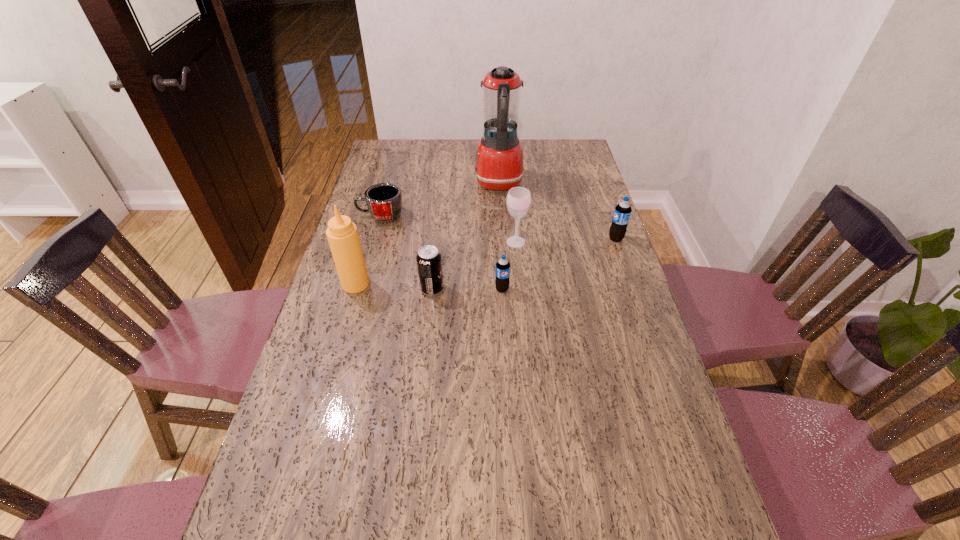
I want to click on vacant region that satisfies the following two spatial constraints: 1. on the back side of the rightmost object; 2. on the controls of the food processor, so click(x=596, y=184).

Where is `vacant space that satisfies the following two spatial constraints: 1. on the front side of the second tallest object; 2. on the right side of the second soda can from left to right`? vacant space that satisfies the following two spatial constraints: 1. on the front side of the second tallest object; 2. on the right side of the second soda can from left to right is located at coordinates (354, 289).

Where is `free space that satisfies the following two spatial constraints: 1. on the side of the fifth shortest object with the handle; 2. on the left side of the sixth nearest object`? The image size is (960, 540). free space that satisfies the following two spatial constraints: 1. on the side of the fifth shortest object with the handle; 2. on the left side of the sixth nearest object is located at coordinates (373, 242).

Locate an element on the screen. Image resolution: width=960 pixels, height=540 pixels. free region that satisfies the following two spatial constraints: 1. on the side of the second farthest object with the handle; 2. on the left side of the farthest soda can is located at coordinates (374, 239).

The height and width of the screenshot is (540, 960). In order to click on vacant space that satisfies the following two spatial constraints: 1. on the controls of the rightmost soda can; 2. on the right side of the food processor in this screenshot , I will do `click(502, 239)`.

This screenshot has width=960, height=540. I want to click on free space that satisfies the following two spatial constraints: 1. on the back side of the fifth object from right to left; 2. on the side of the sixth nearest object with the handle, so click(440, 216).

Where is `blank area in the image that satisfies the following two spatial constraints: 1. on the side of the rightmost soda can with the handle; 2. on the right side of the mug`? blank area in the image that satisfies the following two spatial constraints: 1. on the side of the rightmost soda can with the handle; 2. on the right side of the mug is located at coordinates (374, 239).